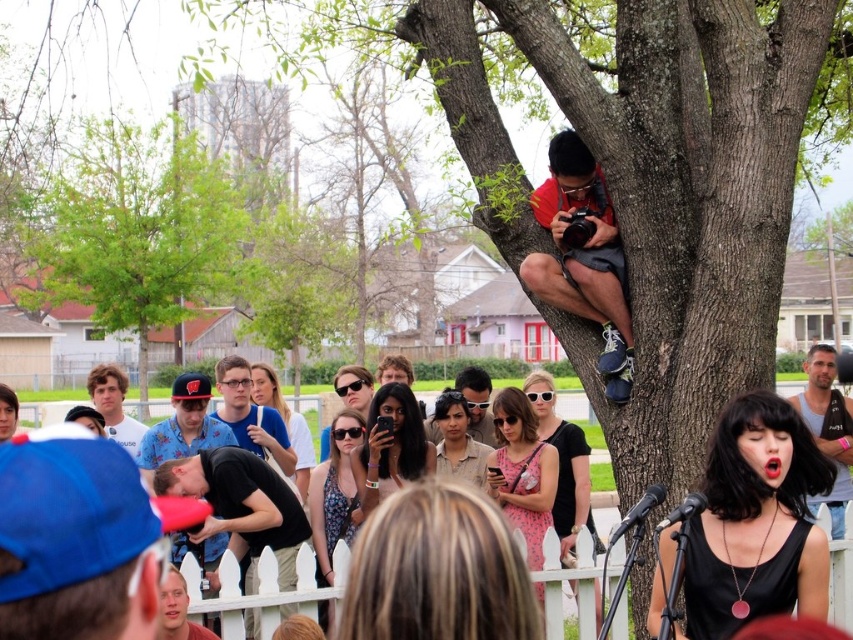
You are a photographer trying to capture a candid shot of the performer without being noticed. There is a red fabric camera at upper center. Where should you position yourself to take the photo?

The red fabric camera at upper center is located at coordinates point (583, 257), so you should position yourself at that point to take the photo.

You are a photographer at the event and want to take a photo of the performer without any obstructions. You have a red fabric camera at upper center and matte black sunglasses at center in your view. Which object is blocking your view of the performer?

The red fabric camera at upper center is positioned on the right side of matte black sunglasses at center, so the red fabric camera at upper center might be blocking the view depending on their exact positions.

You are a photographer at the event and want to take a photo of the matte black sunglasses at center without the red fabric camera at upper center blocking the view. Is this possible?

The red fabric camera at upper center is in front of the matte black sunglasses at center, so it will block the view. You cannot take a photo of the matte black sunglasses at center without the camera obstructing it.